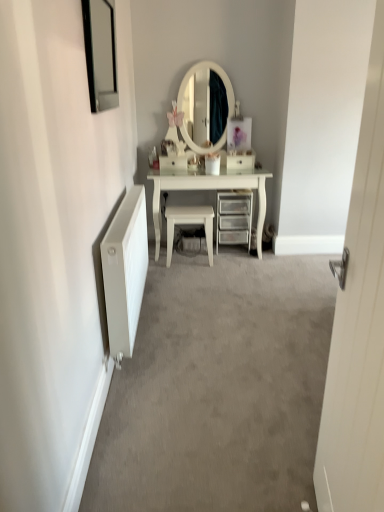
Where is `free space in front of clear plastic drawers at center`? free space in front of clear plastic drawers at center is located at coordinates (240, 262).